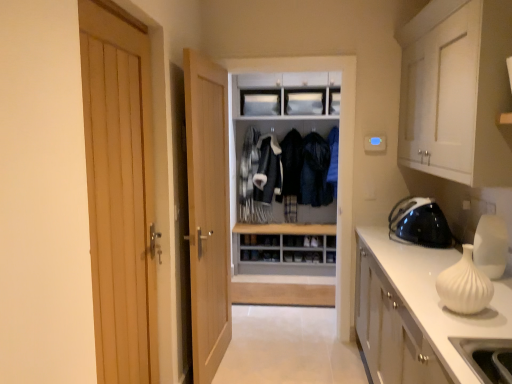
Question: From the image's perspective, is dark blue fabric jacket at center, the 2th clothing from the right, over dark blue leather jacket at center, marked as the first clothing in a right-to-left arrangement?

Choices:
 (A) no
 (B) yes

Answer: (A)

Question: Does dark blue fabric jacket at center, the 2th clothing from the right, lie in front of dark blue leather jacket at center, marked as the first clothing in a right-to-left arrangement?

Choices:
 (A) no
 (B) yes

Answer: (A)

Question: Is the position of dark blue fabric jacket at center, which is the 1th clothing in left-to-right order, more distant than that of dark blue leather jacket at center, marked as the first clothing in a right-to-left arrangement?

Choices:
 (A) yes
 (B) no

Answer: (A)

Question: Is dark blue fabric jacket at center, which is the 1th clothing in left-to-right order, thinner than dark blue leather jacket at center, marked as the 2th clothing in a left-to-right arrangement?

Choices:
 (A) no
 (B) yes

Answer: (B)

Question: Does dark blue fabric jacket at center, the 2th clothing from the right, have a smaller size compared to dark blue leather jacket at center, marked as the first clothing in a right-to-left arrangement?

Choices:
 (A) no
 (B) yes

Answer: (B)

Question: From a real-world perspective, is light wood door at center, marked as the second door in a front-to-back arrangement, physically located above or below white matte cabinet at upper right, which is counted as the 1th cabinetry, starting from the top?

Choices:
 (A) below
 (B) above

Answer: (A)

Question: Which is correct: light wood door at center, arranged as the 2th door when viewed from the left, is inside white matte cabinet at upper right, the second cabinetry from the bottom, or outside of it?

Choices:
 (A) inside
 (B) outside

Answer: (B)

Question: Considering the relative positions of light wood door at center, which is the 1th door in back-to-front order, and white matte cabinet at upper right, the second cabinetry from the bottom, in the image provided, is light wood door at center, which is the 1th door in back-to-front order, to the left or to the right of white matte cabinet at upper right, the second cabinetry from the bottom,?

Choices:
 (A) left
 (B) right

Answer: (A)

Question: In terms of height, does light wood door at center, arranged as the 2th door when viewed from the left, look taller or shorter compared to white matte cabinet at upper right, which is counted as the 1th cabinetry, starting from the top?

Choices:
 (A) short
 (B) tall

Answer: (B)

Question: From the image's perspective, is white matte cabinet at upper right, which is counted as the 1th cabinetry, starting from the top, located above or below dark blue leather jacket at center, marked as the first clothing in a right-to-left arrangement?

Choices:
 (A) above
 (B) below

Answer: (A)

Question: From their relative heights in the image, would you say white matte cabinet at upper right, the second cabinetry from the bottom, is taller or shorter than dark blue leather jacket at center, marked as the 2th clothing in a left-to-right arrangement?

Choices:
 (A) tall
 (B) short

Answer: (B)

Question: Does point (424, 76) appear closer or farther from the camera than point (302, 201)?

Choices:
 (A) closer
 (B) farther

Answer: (A)

Question: Choose the correct answer: Is white matte cabinet at upper right, which is counted as the 1th cabinetry, starting from the top, inside dark blue leather jacket at center, marked as the 2th clothing in a left-to-right arrangement, or outside it?

Choices:
 (A) outside
 (B) inside

Answer: (A)

Question: In terms of width, does white matte cabinet at upper right, the second cabinetry from the bottom, look wider or thinner when compared to light wood door at center, which is the 1th door in back-to-front order?

Choices:
 (A) thin
 (B) wide

Answer: (B)

Question: From the image's perspective, is white matte cabinet at upper right, which is counted as the 1th cabinetry, starting from the top, above or below light wood door at center, which is the 1th door in back-to-front order?

Choices:
 (A) above
 (B) below

Answer: (A)